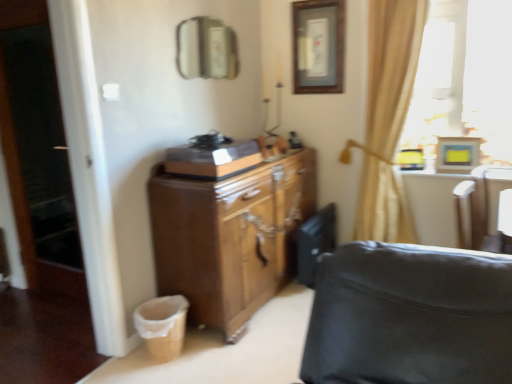
Question: Considering the relative positions of white leather swivel chair at right and metallic rectangular mirror at upper center in the image provided, is white leather swivel chair at right to the left of metallic rectangular mirror at upper center from the viewer's perspective?

Choices:
 (A) no
 (B) yes

Answer: (A)

Question: Does white leather swivel chair at right have a smaller size compared to metallic rectangular mirror at upper center?

Choices:
 (A) no
 (B) yes

Answer: (A)

Question: Can you confirm if white leather swivel chair at right is wider than metallic rectangular mirror at upper center?

Choices:
 (A) no
 (B) yes

Answer: (B)

Question: Is white leather swivel chair at right located outside metallic rectangular mirror at upper center?

Choices:
 (A) no
 (B) yes

Answer: (B)

Question: Is white leather swivel chair at right thinner than metallic rectangular mirror at upper center?

Choices:
 (A) no
 (B) yes

Answer: (A)

Question: From the image's perspective, is white leather swivel chair at right located above or below metallic rectangular mirror at upper center?

Choices:
 (A) above
 (B) below

Answer: (B)

Question: Is white leather swivel chair at right spatially inside metallic rectangular mirror at upper center, or outside of it?

Choices:
 (A) inside
 (B) outside

Answer: (B)

Question: Is point (475, 241) positioned closer to the camera than point (210, 52)?

Choices:
 (A) closer
 (B) farther

Answer: (A)

Question: Considering the relative positions of white leather swivel chair at right and metallic rectangular mirror at upper center in the image provided, is white leather swivel chair at right to the left or to the right of metallic rectangular mirror at upper center?

Choices:
 (A) left
 (B) right

Answer: (B)

Question: Choose the correct answer: Is beige fabric curtain at upper right inside wooden picture frame at upper center, acting as the second picture frame starting from the right, or outside it?

Choices:
 (A) outside
 (B) inside

Answer: (A)

Question: From the image's perspective, relative to wooden picture frame at upper center, acting as the second picture frame starting from the right, is beige fabric curtain at upper right above or below?

Choices:
 (A) above
 (B) below

Answer: (B)

Question: In terms of height, does beige fabric curtain at upper right look taller or shorter compared to wooden picture frame at upper center, arranged as the 2th picture frame when viewed from the front?

Choices:
 (A) short
 (B) tall

Answer: (B)

Question: Considering the positions of beige fabric curtain at upper right and wooden picture frame at upper center, acting as the second picture frame starting from the right, in the image, is beige fabric curtain at upper right wider or thinner than wooden picture frame at upper center, acting as the second picture frame starting from the right,?

Choices:
 (A) wide
 (B) thin

Answer: (A)

Question: Is wooden picture frame at upper right, which is counted as the second picture frame, starting from the left, taller or shorter than wooden picture frame at upper center, acting as the second picture frame starting from the right?

Choices:
 (A) short
 (B) tall

Answer: (A)

Question: In terms of width, does wooden picture frame at upper right, which is counted as the second picture frame, starting from the left, look wider or thinner when compared to wooden picture frame at upper center, the first picture frame from the top?

Choices:
 (A) thin
 (B) wide

Answer: (B)